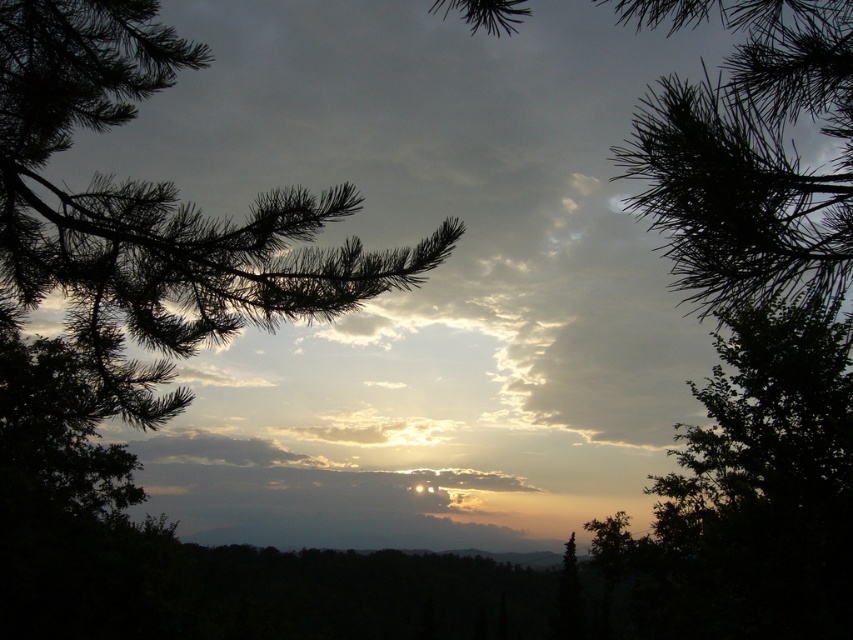
You are standing in the sunset scene and want to walk from the point at coordinates point (3,317) to the point at coordinates point (637,198). Since you can only move forward, will you have to go through any obstacles along the way?

The point at coordinates point (3,317) is closer to you than the point at coordinates point (637,198). Therefore, moving forward towards the latter would require passing through the former, which may be an obstacle depending on its nature. However, since the scene description mentions only silhouettes of trees and branches in the foreground, it is possible that the path is clear except for those elements. Without specific information about objects at those coordinates, we can infer that the main ob

You are an artist trying to paint the sunset scene. You notice two types of needles at the center of the image. Which of the two, the silvery needles at center or the dark green needles at center, do you need to paint smaller in your artwork?

The silvery needles at center is smaller than dark green needles at center, so you should paint the silvery needles at center smaller than the dark green needles at center in your artwork.